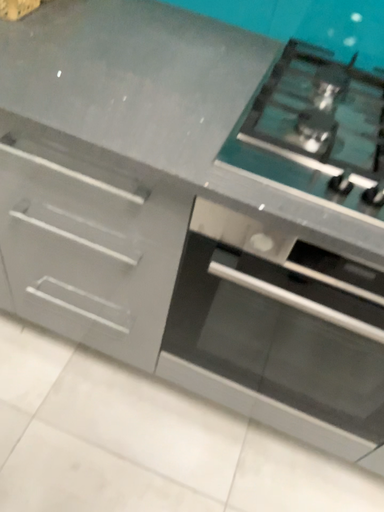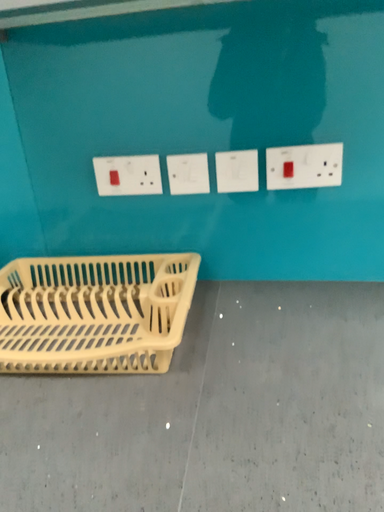
Question: Which way did the camera rotate in the video?

Choices:
 (A) rotated upward
 (B) rotated downward

Answer: (A)